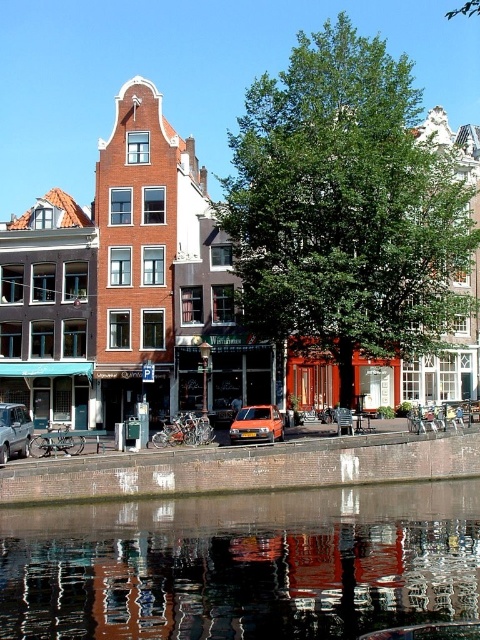
Can you confirm if smooth reflective water at center is bigger than orange matte car at center?

Correct, smooth reflective water at center is larger in size than orange matte car at center.

Who is positioned more to the right, smooth reflective water at center or orange matte car at center?

Positioned to the right is smooth reflective water at center.

At what (x,y) coordinates should I click in order to perform the action: click on smooth reflective water at center. Please return your answer as a coordinate pair (x, y). The width and height of the screenshot is (480, 640). Looking at the image, I should click on (242, 564).

Is orange matte car at center taller than silver metallic car at lower left?

In fact, orange matte car at center may be shorter than silver metallic car at lower left.

Locate an element on the screen. Image resolution: width=480 pixels, height=640 pixels. orange matte car at center is located at coordinates (256, 424).

I want to click on orange matte car at center, so click(x=256, y=424).

The width and height of the screenshot is (480, 640). What do you see at coordinates (242, 564) in the screenshot? I see `smooth reflective water at center` at bounding box center [242, 564].

Which is in front, point (472, 586) or point (16, 436)?

Positioned in front is point (472, 586).

Is point (467, 540) positioned in front of point (11, 403)?

Yes.

Find the location of a particular element. The width and height of the screenshot is (480, 640). smooth reflective water at center is located at coordinates (242, 564).